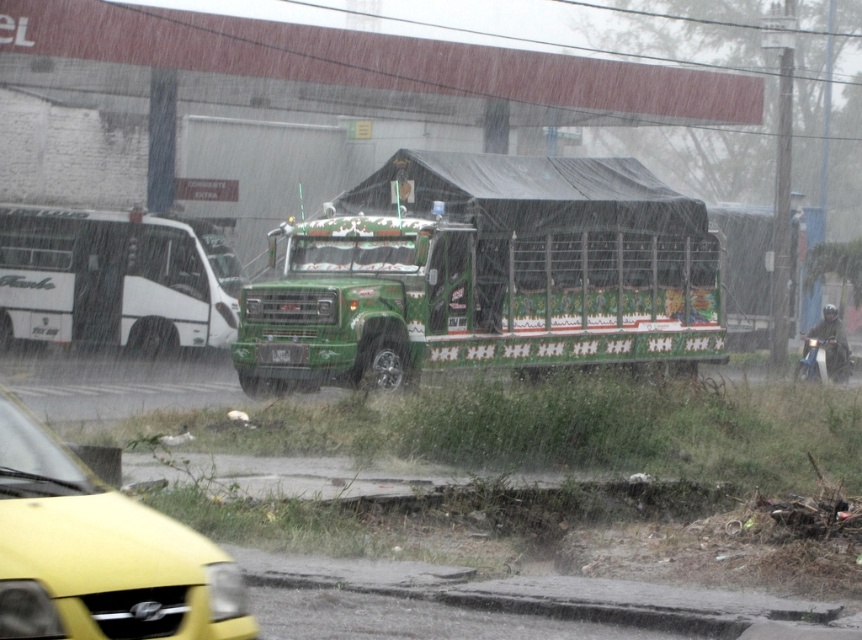
Can you confirm if yellow matte car at lower left is positioned to the right of white matte bus at left?

Indeed, yellow matte car at lower left is positioned on the right side of white matte bus at left.

Looking at this image, who is shorter, yellow matte car at lower left or white matte bus at left?

yellow matte car at lower left

Which is behind, point (111, 609) or point (89, 292)?

Positioned behind is point (89, 292).

Locate an element on the screen. yellow matte car at lower left is located at coordinates (98, 554).

Is green painted metal trailer truck at center above yellow matte car at lower left?

Yes, green painted metal trailer truck at center is above yellow matte car at lower left.

Which is behind, point (492, 276) or point (201, 593)?

Positioned behind is point (492, 276).

Identify the location of green painted metal trailer truck at center. The height and width of the screenshot is (640, 862). (484, 275).

The height and width of the screenshot is (640, 862). What do you see at coordinates (484, 275) in the screenshot? I see `green painted metal trailer truck at center` at bounding box center [484, 275].

How much distance is there between green painted metal trailer truck at center and white matte bus at left?

The distance of green painted metal trailer truck at center from white matte bus at left is 9.89 meters.

This screenshot has width=862, height=640. I want to click on green painted metal trailer truck at center, so [x=484, y=275].

Locate an element on the screen. The image size is (862, 640). green painted metal trailer truck at center is located at coordinates (x=484, y=275).